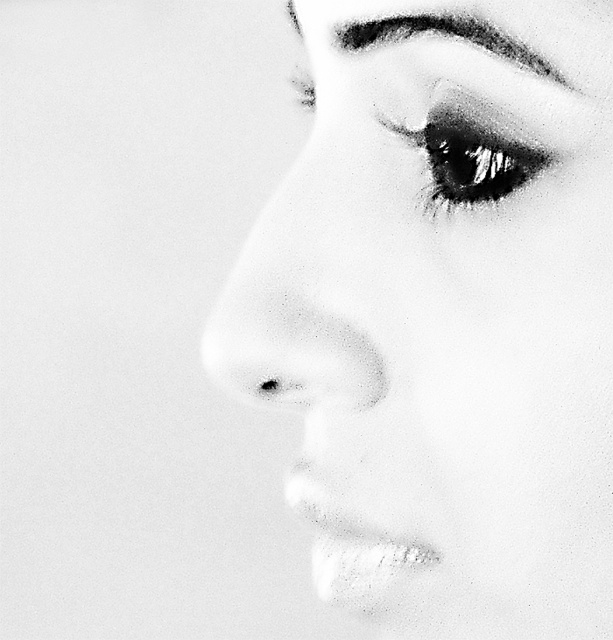
Question: Does shiny black eye at upper right have a smaller size compared to black textured eyebrow at upper center?

Choices:
 (A) no
 (B) yes

Answer: (B)

Question: In this image, where is smooth skin face at upper right located relative to shiny black eye at upper right?

Choices:
 (A) below
 (B) above

Answer: (A)

Question: Which point is farther to the camera?

Choices:
 (A) (495, 611)
 (B) (337, 29)

Answer: (A)

Question: Estimate the real-world distances between objects in this image. Which object is closer to the black textured eyebrow at upper center?

Choices:
 (A) smooth skin face at upper right
 (B) shiny black eye at upper right

Answer: (B)

Question: Which is nearer to the shiny black eye at upper right?

Choices:
 (A) smooth skin face at upper right
 (B) black textured eyebrow at upper center

Answer: (B)

Question: Does smooth skin face at upper right have a greater width compared to shiny black eye at upper right?

Choices:
 (A) no
 (B) yes

Answer: (B)